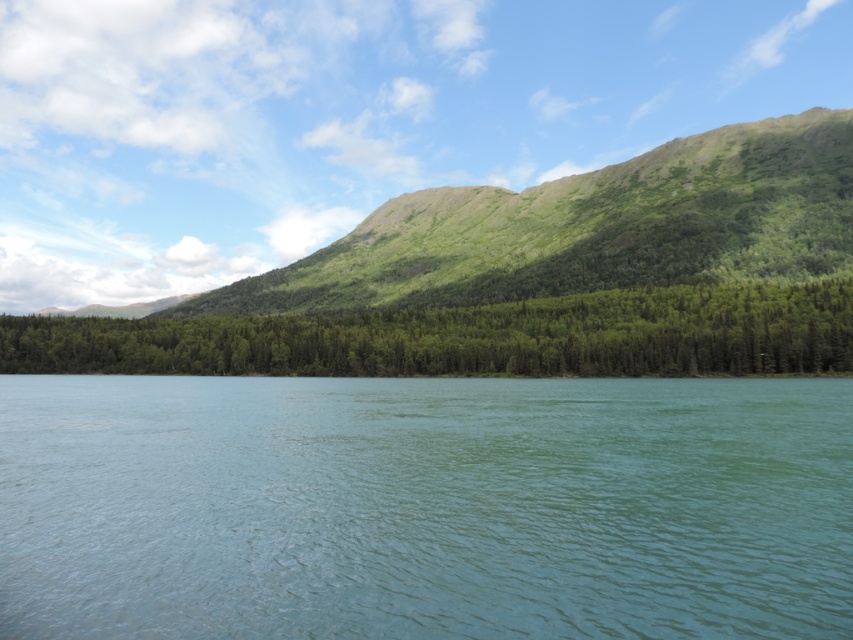
You are standing at the edge of the green smooth water at center and want to see the green matte forest at center. Which direction should you look to see the forest?

The green matte forest at center is taller than the green smooth water at center, so you should look upward to see the green matte forest at center.

You are standing at the edge of the landscape and want to take a photo that includes both the green smooth water at center and the green matte forest at center. Based on their positions, which one will appear closer to you in the photo?

The green smooth water at center will appear closer to you in the photo because it is positioned in front of the green matte forest at center.